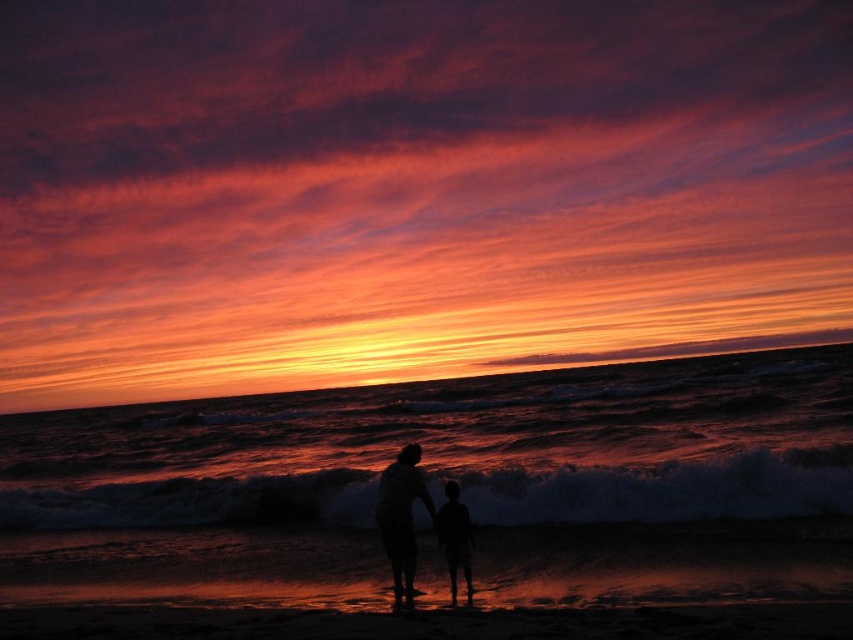
From the picture: You are standing on the beach and notice a dark textured wave at center and a silhouette figure at center. Which object is positioned more to the left from your perspective?

The dark textured wave at center is to the left of the silhouette figure at center, so it is positioned more to the left.

You are standing on the beach and see the dark textured wave at center approaching you. If you can run at 5 meters per second, how many seconds do you have before the wave reaches you?

The dark textured wave at center is 17.48 meters away from you. Since you can run at 5 meters per second, you have approximately 3.5 seconds before the wave reaches you. This is calculated by dividing the distance by your speed.

You are standing on the beach and see the dark textured wave at center and the silhouette figure at lower center. Which object appears larger in the image?

The dark textured wave at center appears larger than the silhouette figure at lower center in the image.